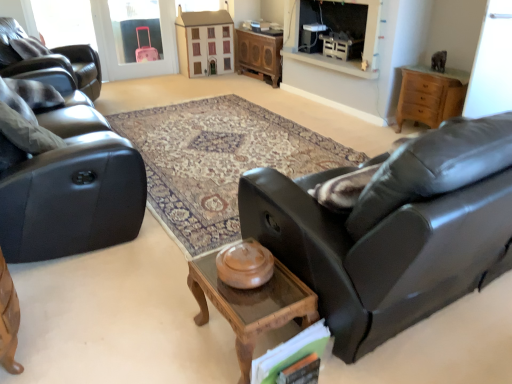
Question: Does transparent glass door at upper right lie behind matte brown wooden dresser at upper center?

Choices:
 (A) yes
 (B) no

Answer: (B)

Question: Does transparent glass door at upper right have a greater height compared to matte brown wooden dresser at upper center?

Choices:
 (A) yes
 (B) no

Answer: (B)

Question: Considering the relative positions of transparent glass door at upper right and matte brown wooden dresser at upper center in the image provided, is transparent glass door at upper right to the right of matte brown wooden dresser at upper center from the viewer's perspective?

Choices:
 (A) yes
 (B) no

Answer: (A)

Question: Is matte brown wooden dresser at upper center completely or partially inside transparent glass door at upper right?

Choices:
 (A) yes
 (B) no

Answer: (B)

Question: Does transparent glass door at upper right have a greater width compared to matte brown wooden dresser at upper center?

Choices:
 (A) no
 (B) yes

Answer: (A)

Question: Would you say transparent glass door at upper right is a long distance from matte brown wooden dresser at upper center?

Choices:
 (A) no
 (B) yes

Answer: (B)

Question: Can you confirm if wooden cabinet at center is positioned to the right of wooden cabinet at right?

Choices:
 (A) yes
 (B) no

Answer: (B)

Question: Is wooden cabinet at center positioned with its back to wooden cabinet at right?

Choices:
 (A) yes
 (B) no

Answer: (B)

Question: Is wooden cabinet at center taller than wooden cabinet at right?

Choices:
 (A) no
 (B) yes

Answer: (B)

Question: From the image's perspective, is wooden cabinet at center located above wooden cabinet at right?

Choices:
 (A) yes
 (B) no

Answer: (A)

Question: Is wooden cabinet at right surrounded by wooden cabinet at center?

Choices:
 (A) yes
 (B) no

Answer: (B)

Question: Considering the relative positions of wooden cabinet at center and wooden cabinet at right in the image provided, is wooden cabinet at center in front of wooden cabinet at right?

Choices:
 (A) yes
 (B) no

Answer: (B)

Question: Is wooden cabinet at center to the left of matte black recliner at left from the viewer's perspective?

Choices:
 (A) yes
 (B) no

Answer: (B)